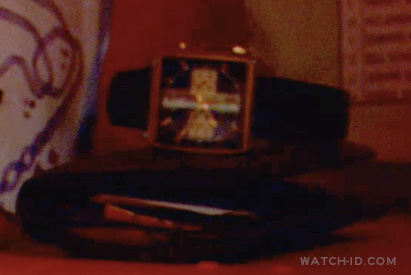
Where is `poster`? This screenshot has height=275, width=411. poster is located at coordinates (377, 63).